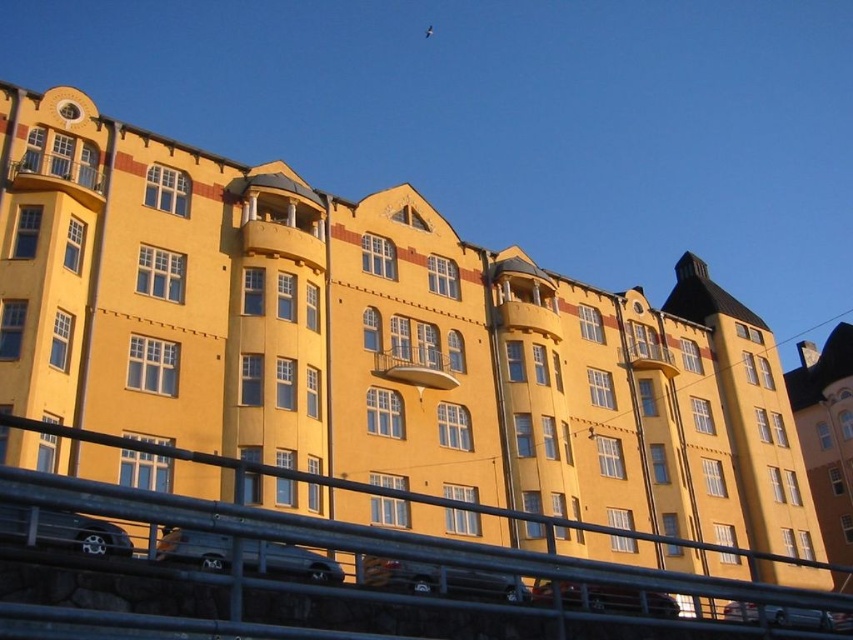
You are standing on a bridge overlooking a residential building. You notice two cars below you, a metallic silver car at lower center and a shiny silver car at lower left. Which car is closer to you?

The metallic silver car at lower center is closer to the viewer than the shiny silver car at lower left.

You are a delivery driver trying to park your vehicle in the parking spot between the metallic silver car at lower center and the shiny silver car at lower left. The parking spot is exactly 2 meters wide. Can your 1.8 meter wide van fit in the space?

The metallic silver car at lower center might be wider than shiny silver car at lower left, so the space between them may not be wide enough for your 1.8 meter wide van. Check the actual width before attempting to park.

You are standing on a bridge looking at the residential building. You see a point marked at coordinates [194,548]. What object is located at that point?

The point at coordinates [194,548] indicates a silver metallic van at lower center.